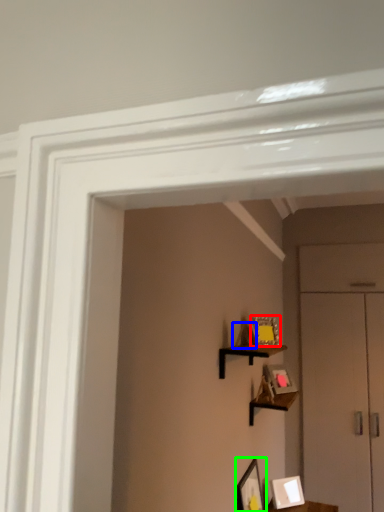
Question: Which is nearer to the picture frame (highlighted by a red box)? picture frame (highlighted by a blue box) or picture frame (highlighted by a green box).

Choices:
 (A) picture frame
 (B) picture frame

Answer: (A)